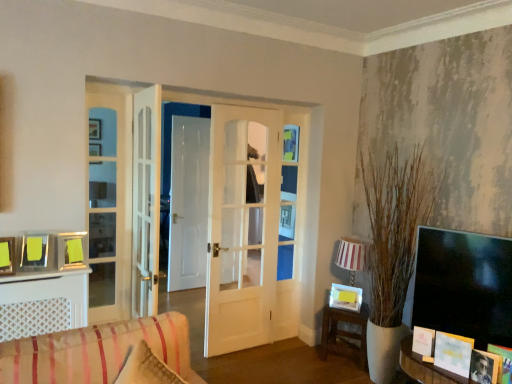
Question: Should I look upward or downward to see white paper book at lower right?

Choices:
 (A) up
 (B) down

Answer: (B)

Question: Should I look upward or downward to see metallic silver picture frame at left, which ranks as the 2th picture frame in left-to-right order?

Choices:
 (A) down
 (B) up

Answer: (A)

Question: Considering the relative positions of matte silver picture frame at upper left, acting as the first picture frame starting from the left, and striped fabric sofa at lower left in the image provided, is matte silver picture frame at upper left, acting as the first picture frame starting from the left, to the right of striped fabric sofa at lower left from the viewer's perspective?

Choices:
 (A) yes
 (B) no

Answer: (B)

Question: Does matte silver picture frame at upper left, the first picture frame in the top-to-bottom sequence, have a larger size compared to striped fabric sofa at lower left?

Choices:
 (A) no
 (B) yes

Answer: (A)

Question: Is striped fabric sofa at lower left located within matte silver picture frame at upper left, marked as the seventh picture frame in a front-to-back arrangement?

Choices:
 (A) yes
 (B) no

Answer: (B)

Question: From a real-world perspective, is matte silver picture frame at upper left, the first picture frame in the top-to-bottom sequence, physically above striped fabric sofa at lower left?

Choices:
 (A) no
 (B) yes

Answer: (B)

Question: Is matte silver picture frame at upper left, the first picture frame in the top-to-bottom sequence, aimed at striped fabric sofa at lower left?

Choices:
 (A) yes
 (B) no

Answer: (A)

Question: Is matte silver picture frame at upper left, the seventh picture frame when ordered from bottom to top, behind striped fabric sofa at lower left?

Choices:
 (A) no
 (B) yes

Answer: (B)

Question: Does white paper book at lower right come in front of wooden picture frame at lower right, marked as the first picture frame in a front-to-back arrangement?

Choices:
 (A) yes
 (B) no

Answer: (B)

Question: From the image's perspective, would you say white paper book at lower right is shown under wooden picture frame at lower right, the sixth picture frame viewed from the top?

Choices:
 (A) yes
 (B) no

Answer: (B)

Question: From a real-world perspective, is white paper book at lower right below wooden picture frame at lower right, the seventh picture frame from the back?

Choices:
 (A) yes
 (B) no

Answer: (B)

Question: Is white paper book at lower right smaller than wooden picture frame at lower right, marked as the first picture frame in a front-to-back arrangement?

Choices:
 (A) no
 (B) yes

Answer: (A)

Question: Are white paper book at lower right and wooden picture frame at lower right, the seventh picture frame positioned from the left, far apart?

Choices:
 (A) yes
 (B) no

Answer: (B)

Question: Is white paper book at lower right facing towards wooden picture frame at lower right, the first picture frame positioned from the right?

Choices:
 (A) yes
 (B) no

Answer: (B)

Question: Is wooden table at lower right aimed at white paper picture frame at lower right, which ranks as the fifth picture frame in top-to-bottom order?

Choices:
 (A) yes
 (B) no

Answer: (B)